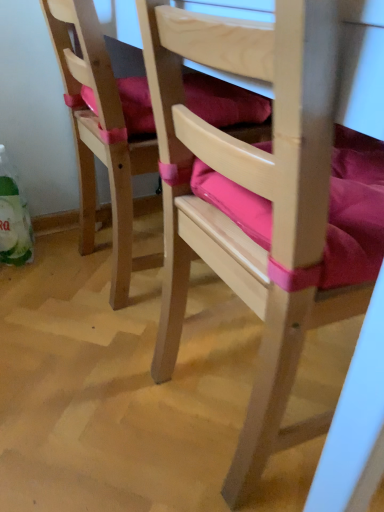
Question: From a real-world perspective, is wooden chair with pink cushion at center, the second chair in the left-to-right sequence, above or below pink fabric cushion at left, which is the 1th chair in left-to-right order?

Choices:
 (A) below
 (B) above

Answer: (B)

Question: In the image, is wooden chair with pink cushion at center, the second chair in the left-to-right sequence, on the left side or the right side of pink fabric cushion at left, which ranks as the second chair in right-to-left order?

Choices:
 (A) left
 (B) right

Answer: (B)

Question: Considering the positions of wooden chair with pink cushion at center, the second chair in the left-to-right sequence, and pink fabric cushion at left, which ranks as the second chair in right-to-left order, in the image, is wooden chair with pink cushion at center, the second chair in the left-to-right sequence, taller or shorter than pink fabric cushion at left, which ranks as the second chair in right-to-left order,?

Choices:
 (A) tall
 (B) short

Answer: (A)

Question: Considering the relative positions of pink fabric cushion at left, which ranks as the second chair in right-to-left order, and wooden chair with pink cushion at center, the second chair in the left-to-right sequence, in the image provided, is pink fabric cushion at left, which ranks as the second chair in right-to-left order, to the left or to the right of wooden chair with pink cushion at center, the second chair in the left-to-right sequence,?

Choices:
 (A) left
 (B) right

Answer: (A)

Question: From a real-world perspective, relative to wooden chair with pink cushion at center, the second chair in the left-to-right sequence, is pink fabric cushion at left, which is the 1th chair in left-to-right order, vertically above or below?

Choices:
 (A) above
 (B) below

Answer: (B)

Question: From the image's perspective, is pink fabric cushion at left, which ranks as the second chair in right-to-left order, positioned above or below wooden chair with pink cushion at center, the second chair in the left-to-right sequence?

Choices:
 (A) below
 (B) above

Answer: (B)

Question: Would you say pink fabric cushion at left, which is the 1th chair in left-to-right order, is inside or outside wooden chair with pink cushion at center, the second chair in the left-to-right sequence?

Choices:
 (A) inside
 (B) outside

Answer: (B)